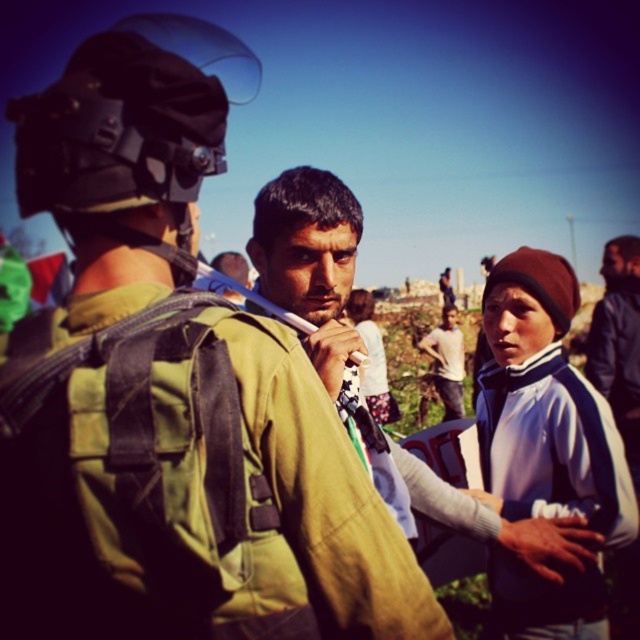
You are a photographer trying to capture a candid shot of both the blue fleece jacket at right and the white fleece jacket at center. Based on their positions, which jacket is positioned further to the right side of the image?

The blue fleece jacket at right is positioned further to the right side of the image compared to the white fleece jacket at center.

You are a security guard assessing the situation between the matte green uniform at center and the blue fleece jacket at right. Which individual has a wider stance? Please base your answer on the scene description provided.

The matte green uniform at center has a wider stance than the blue fleece jacket at right, as stated in the objects description.

You are a drone operator observing the scene. You need to determine which of the two points, point (480, 433) or point (456, 316), is closer to your camera. Based on the description, which one is closer?

Point (480, 433) is closer to the viewer than point (456, 316).